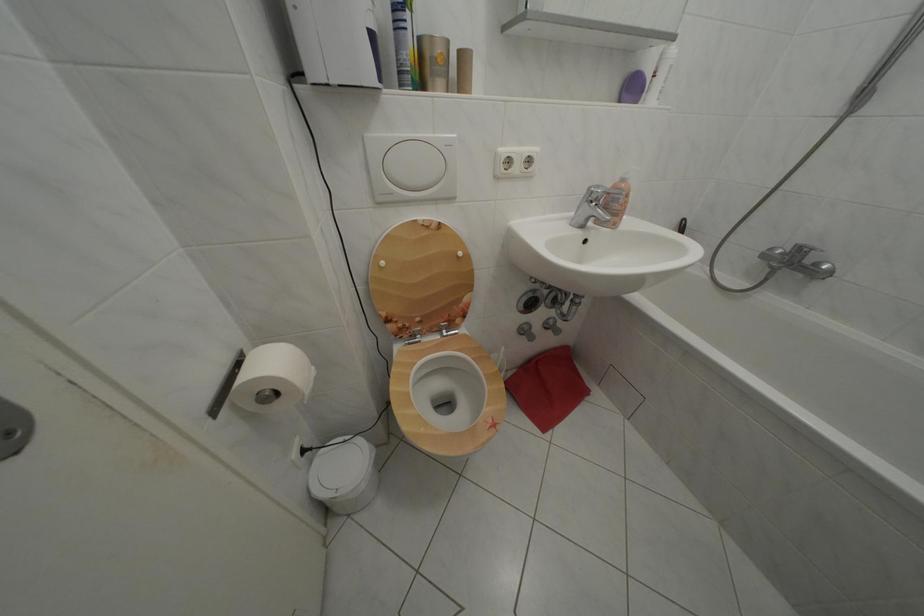
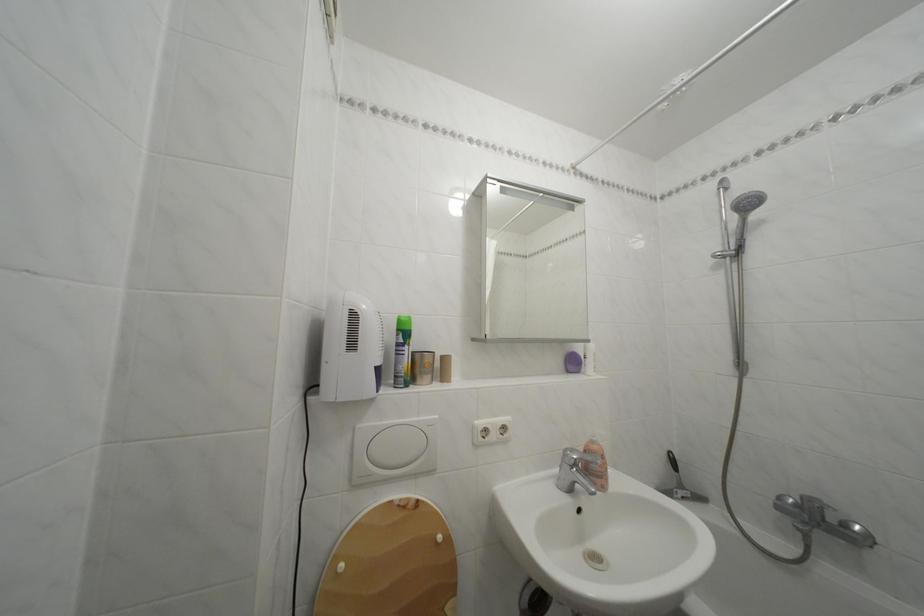
The point at (392, 269) is marked in the first image. Where is the corresponding point in the second image?

(350, 573)